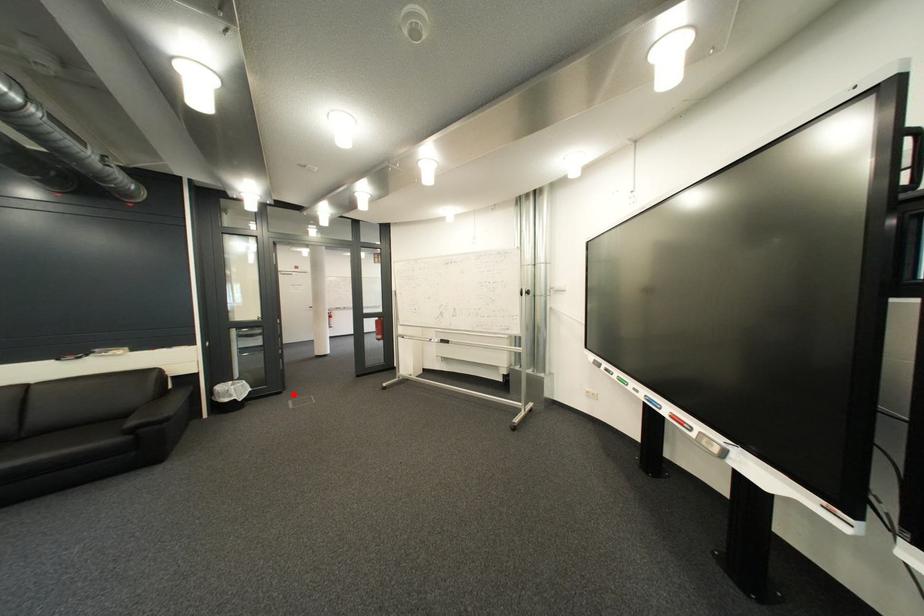
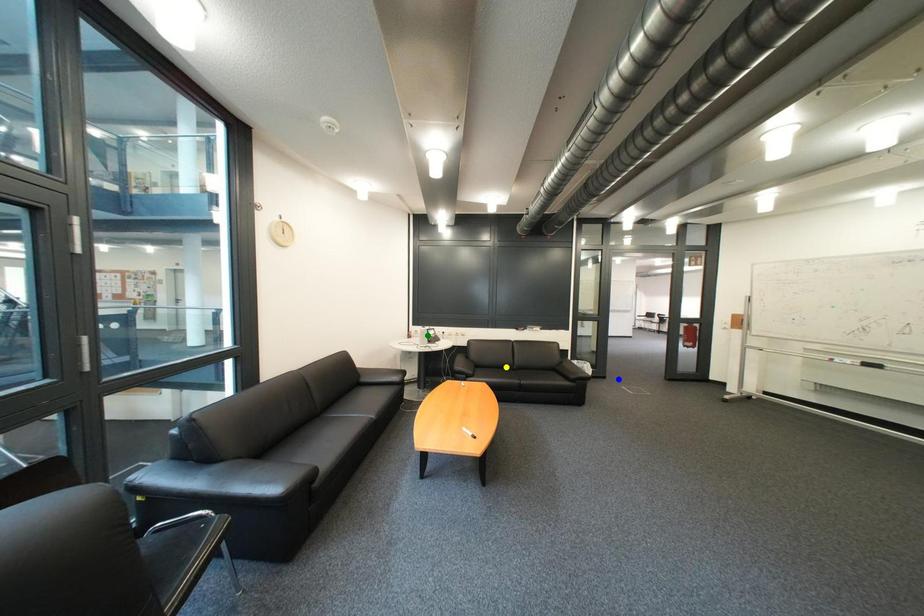
Question: I am providing you with two images of the same scene from different viewpoints. A red point is marked on the first image. You are given multiple points on the second image. Which mark in image 2 goes with the point in image 1?

Choices:
 (A) green point
 (B) yellow point
 (C) blue point

Answer: (C)